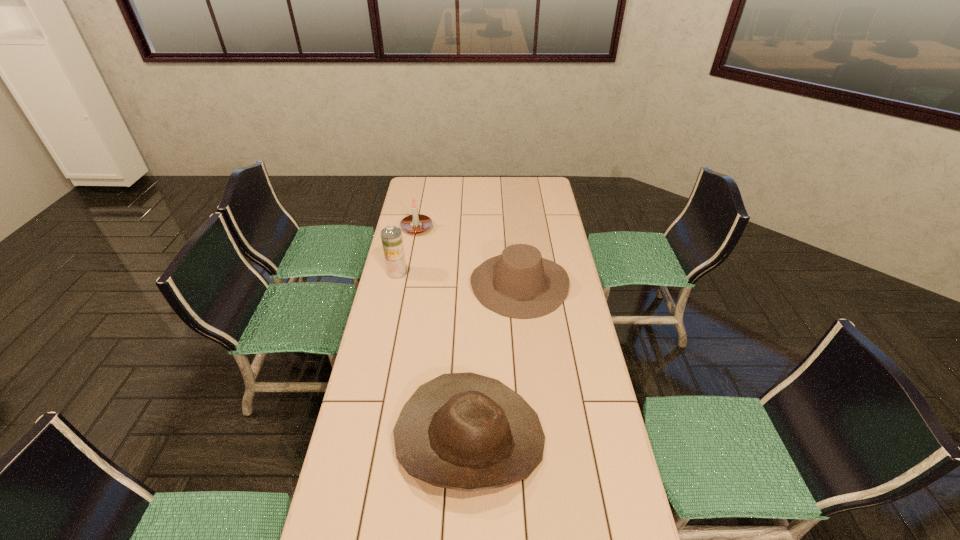
Find the location of a particular element. This screenshot has width=960, height=540. free space between the candle and the nearest object is located at coordinates (444, 333).

The height and width of the screenshot is (540, 960). I want to click on vacant region between the farther cowboy hat and the farthest object, so click(x=468, y=255).

This screenshot has height=540, width=960. I want to click on unoccupied position between the nearest object and the farther cowboy hat, so click(x=494, y=361).

At what (x,y) coordinates should I click in order to perform the action: click on free spot between the candle and the aerosol can. Please return your answer as a coordinate pair (x, y). The width and height of the screenshot is (960, 540). Looking at the image, I should click on (407, 250).

Locate an element on the screen. The image size is (960, 540). free point between the nearer cowboy hat and the farthest object is located at coordinates (444, 333).

At what (x,y) coordinates should I click in order to perform the action: click on free space between the farthest object and the farther cowboy hat. Please return your answer as a coordinate pair (x, y). This screenshot has height=540, width=960. Looking at the image, I should click on point(468,255).

Identify the location of vacant region between the farther cowboy hat and the tallest object. (458, 278).

Where is `object that is the third nearest to the tallest object`? Image resolution: width=960 pixels, height=540 pixels. object that is the third nearest to the tallest object is located at coordinates (464, 431).

Identify which object is located as the second nearest to the tallest object. Please provide its 2D coordinates. Your answer should be formatted as a tuple, i.e. [(x, y)], where the tuple contains the x and y coordinates of a point satisfying the conditions above.

[(519, 283)]

Locate an element on the screen. The width and height of the screenshot is (960, 540). vacant point that satisfies the following two spatial constraints: 1. on the back side of the candle; 2. on the left side of the aerosol can is located at coordinates (407, 228).